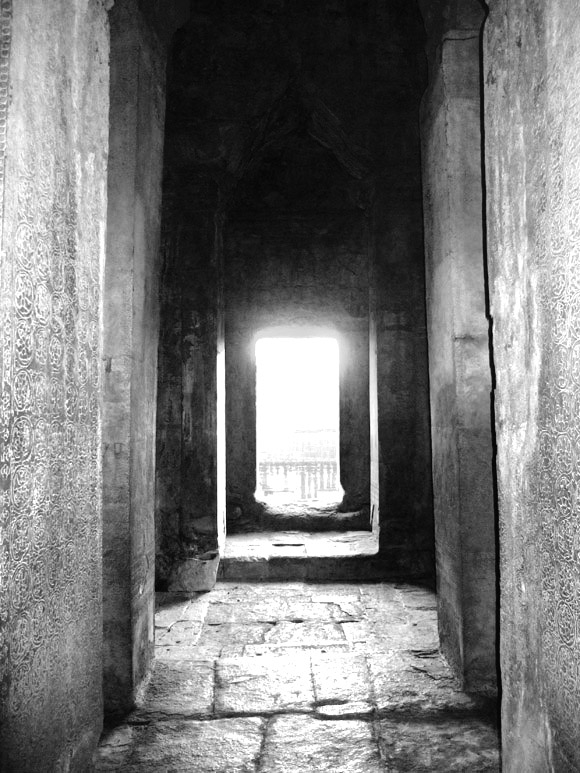
You are a GUI agent. You are given a task and a screenshot of the screen. Output one action in this format:
    pyautogui.click(x=<x>, y=<y>)
    Task: Click on the celing
    
    Given the screenshot: What is the action you would take?
    pyautogui.click(x=329, y=116)